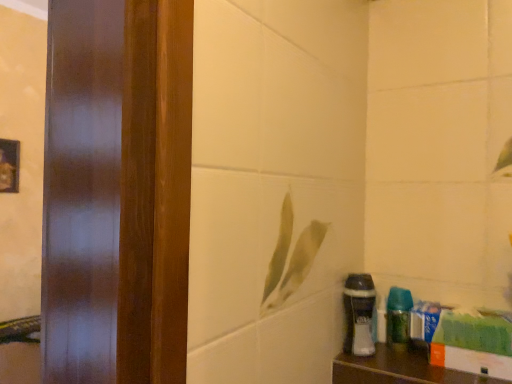
Question: Considering the relative sizes of white matte shaving cream at lower right and wooden shelf at lower right in the image provided, is white matte shaving cream at lower right taller than wooden shelf at lower right?

Choices:
 (A) no
 (B) yes

Answer: (B)

Question: Does white matte shaving cream at lower right have a greater width compared to wooden shelf at lower right?

Choices:
 (A) no
 (B) yes

Answer: (A)

Question: Is white matte shaving cream at lower right at the right side of wooden shelf at lower right?

Choices:
 (A) no
 (B) yes

Answer: (A)

Question: From the image's perspective, is white matte shaving cream at lower right over wooden shelf at lower right?

Choices:
 (A) no
 (B) yes

Answer: (B)

Question: Can you confirm if white matte shaving cream at lower right is thinner than wooden shelf at lower right?

Choices:
 (A) no
 (B) yes

Answer: (B)

Question: Relative to wooden shelf at lower right, is green glossy spray bottle at lower right in front or behind?

Choices:
 (A) front
 (B) behind

Answer: (B)

Question: Looking at their shapes, would you say green glossy spray bottle at lower right is wider or thinner than wooden shelf at lower right?

Choices:
 (A) thin
 (B) wide

Answer: (A)

Question: Does point (389, 297) appear closer or farther from the camera than point (340, 357)?

Choices:
 (A) farther
 (B) closer

Answer: (A)

Question: From the image's perspective, is green glossy spray bottle at lower right above or below wooden shelf at lower right?

Choices:
 (A) below
 (B) above

Answer: (B)

Question: From the image's perspective, is green glossy spray bottle at lower right positioned above or below white matte shaving cream at lower right?

Choices:
 (A) below
 (B) above

Answer: (A)

Question: From a real-world perspective, is green glossy spray bottle at lower right positioned above or below white matte shaving cream at lower right?

Choices:
 (A) above
 (B) below

Answer: (B)

Question: In the image, is green glossy spray bottle at lower right positioned in front of or behind white matte shaving cream at lower right?

Choices:
 (A) behind
 (B) front

Answer: (A)

Question: Is point (403, 327) closer or farther from the camera than point (355, 299)?

Choices:
 (A) closer
 (B) farther

Answer: (B)

Question: Considering the positions of wooden shelf at lower right and white matte shaving cream at lower right in the image, is wooden shelf at lower right taller or shorter than white matte shaving cream at lower right?

Choices:
 (A) short
 (B) tall

Answer: (A)

Question: From a real-world perspective, is wooden shelf at lower right above or below white matte shaving cream at lower right?

Choices:
 (A) below
 (B) above

Answer: (A)